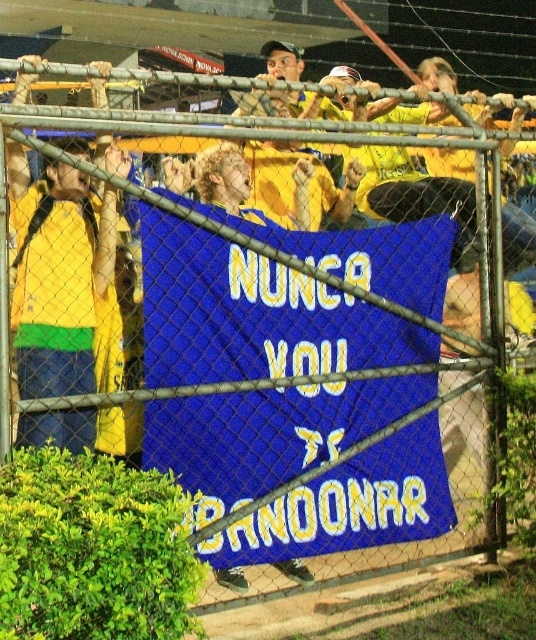
Question: Where is blue fabric banner at center located in relation to matte yellow jersey at left in the image?

Choices:
 (A) left
 (B) right

Answer: (B)

Question: Which of the following is the farthest from the observer?

Choices:
 (A) (43, 362)
 (B) (205, 554)

Answer: (B)

Question: Which object is farther from the camera taking this photo?

Choices:
 (A) matte yellow jersey at left
 (B) blue fabric banner at center

Answer: (B)

Question: Can you confirm if blue fabric banner at center is positioned to the right of matte yellow jersey at left?

Choices:
 (A) yes
 (B) no

Answer: (A)

Question: From the image, what is the correct spatial relationship of blue fabric banner at center in relation to matte yellow jersey at left?

Choices:
 (A) right
 (B) left

Answer: (A)